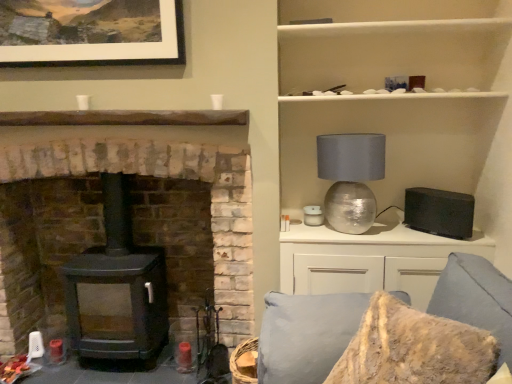
Question: Considering the relative positions of textured gray couch at lower right and white matte cabinet at upper right in the image provided, is textured gray couch at lower right to the left or to the right of white matte cabinet at upper right?

Choices:
 (A) left
 (B) right

Answer: (A)

Question: Is textured gray couch at lower right situated inside white matte cabinet at upper right or outside?

Choices:
 (A) inside
 (B) outside

Answer: (B)

Question: Which of these objects is positioned farthest from the white glossy cabinet at upper right?

Choices:
 (A) black matte wood burning stove at left
 (B) matte white picture frame at upper center
 (C) white matte cabinet at upper right
 (D) black matte speaker at right
 (E) matte black wood stove at left

Answer: (B)

Question: Which of these objects is positioned closest to the black matte wood burning stove at left?

Choices:
 (A) white matte cabinet at upper right
 (B) textured gray couch at lower right
 (C) matte black wood stove at left
 (D) matte white picture frame at upper center
 (E) metallic silver sphere at upper right

Answer: (C)